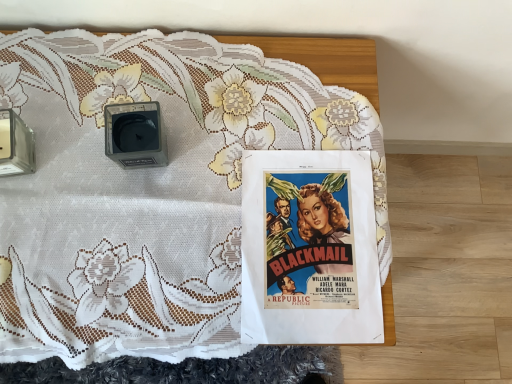
This screenshot has width=512, height=384. I want to click on free spot to the right of matte black alarm clock at upper left, so click(x=228, y=142).